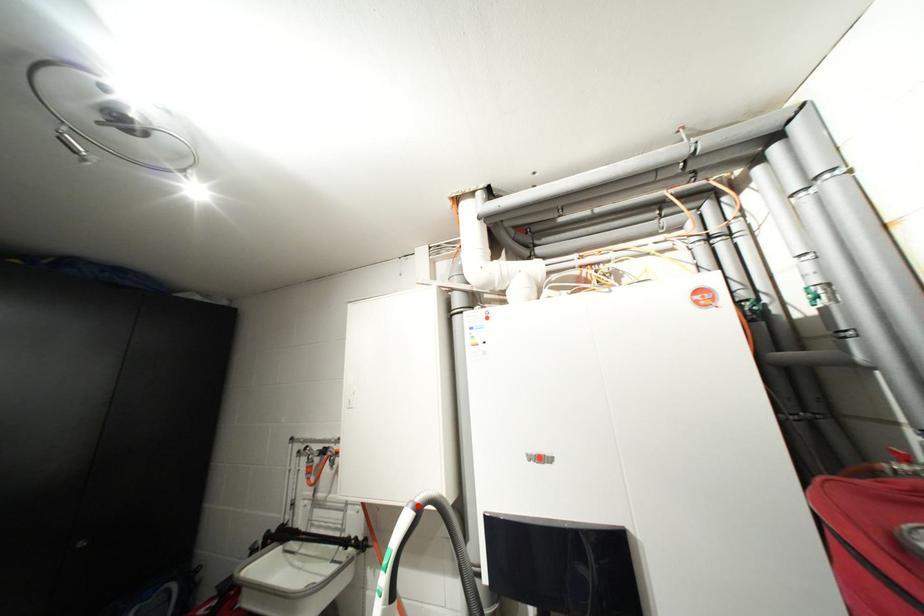
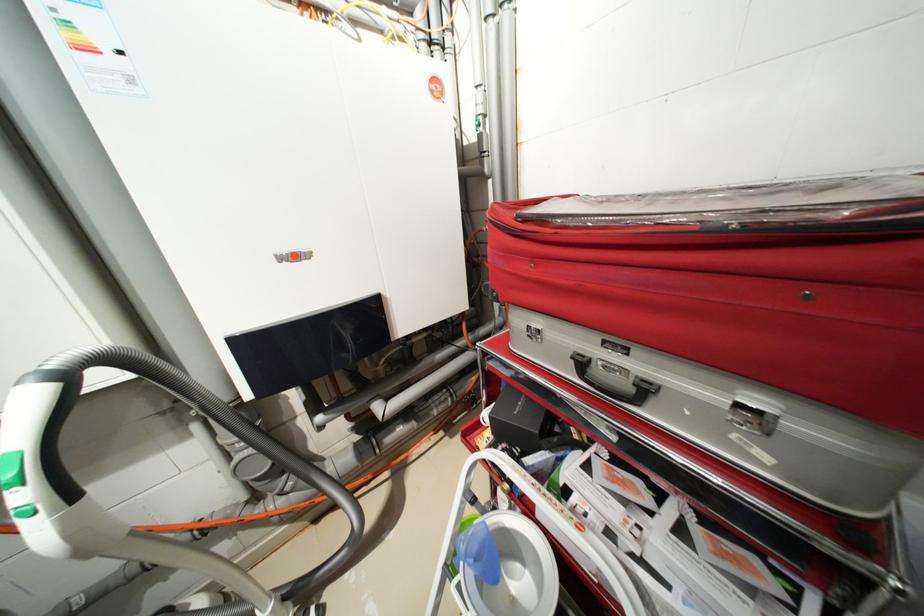
Question: I am providing you with two images of the same scene from different viewpoints. A red point is shown in image1. For the corresponding object point in image2, is it positioned nearer or farther from the camera?

Choices:
 (A) Nearer
 (B) Farther

Answer: (A)